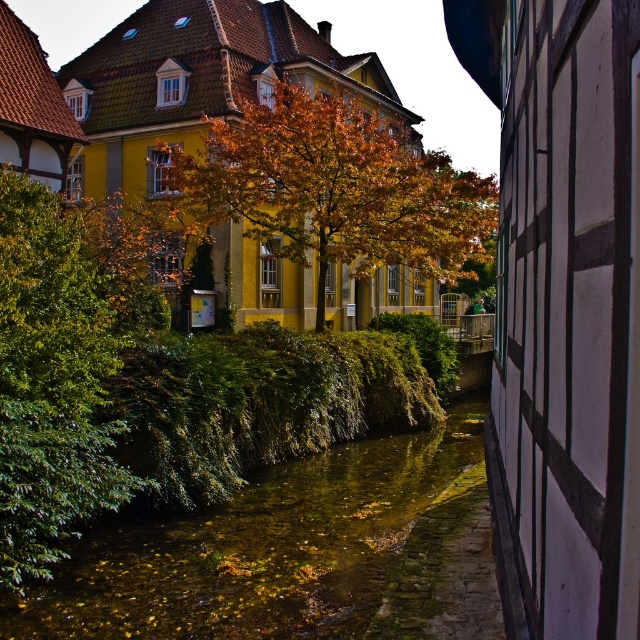
You are a tourist standing on the bridge overlooking the green mossy water at center and the green leafy tree at left. You want to take a photo that includes both objects in the frame. Considering their distance, is it possible to capture both in a single shot without moving the camera?

The green mossy water at center is 2.89 meters away from the green leafy tree at left. Since they are relatively close in distance from the camera position on the bridge, it is feasible to capture both in a single shot without moving the camera.

You are a tourist standing on the bridge above the canal. You see the green mossy water at center and autumn leaves at center. Which one is closer to your right side?

The autumn leaves at center are closer to your right side because the green mossy water at center is to the left of autumn leaves at center.

You are standing at the point marked as point (472, 236) in the image. You want to take a photo of the traditional European building. Is the building within your camera lens field of view?

The point (472, 236) is 19.36 meters away from the viewer. Since the building is within the scene and the distance is reasonable for capturing it in a photo, the building should be within the camera lens field of view.